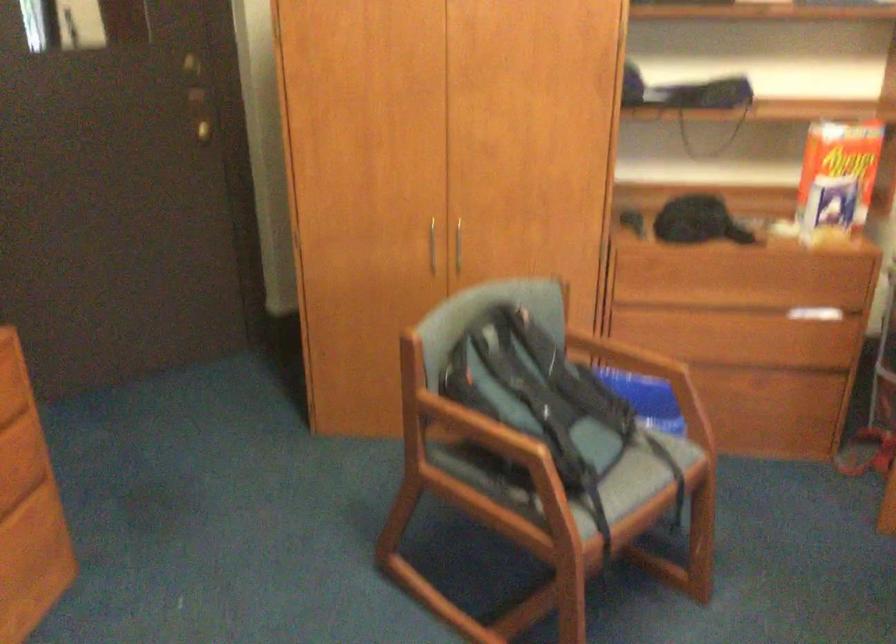
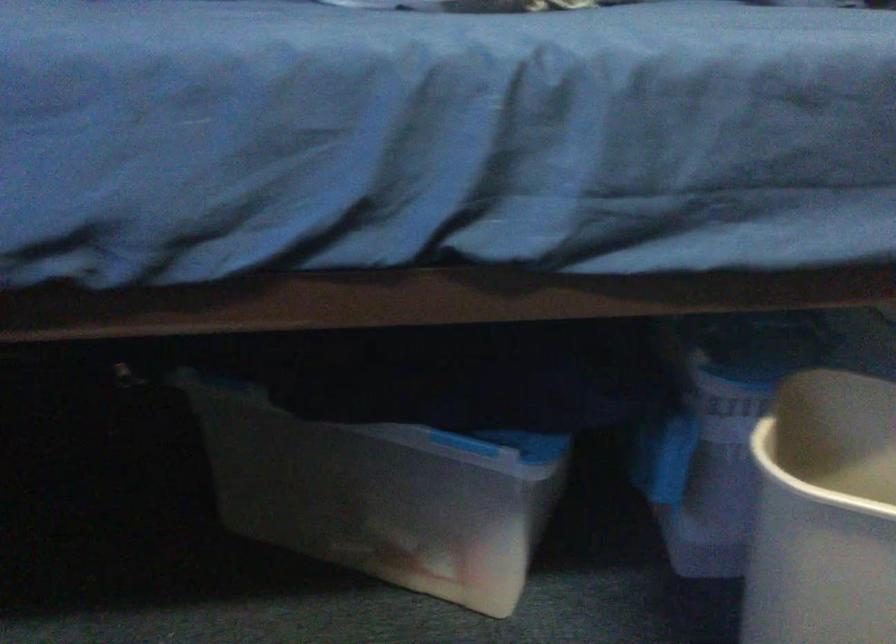
How did the camera likely rotate?

The camera's rotation is toward left-down.